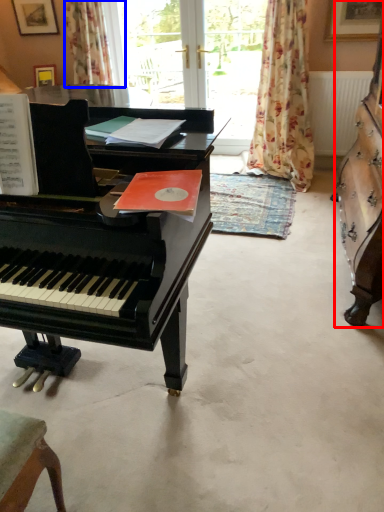
Question: Which point is further to the camera, harpsichord (highlighted by a red box) or curtain (highlighted by a blue box)?

Choices:
 (A) harpsichord
 (B) curtain

Answer: (B)